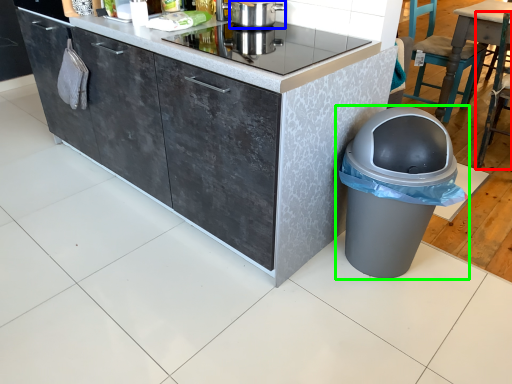
Question: Considering the real-world distances, which object is closest to chair (highlighted by a red box)? kitchen appliance (highlighted by a blue box) or waste container (highlighted by a green box).

Choices:
 (A) kitchen appliance
 (B) waste container

Answer: (B)